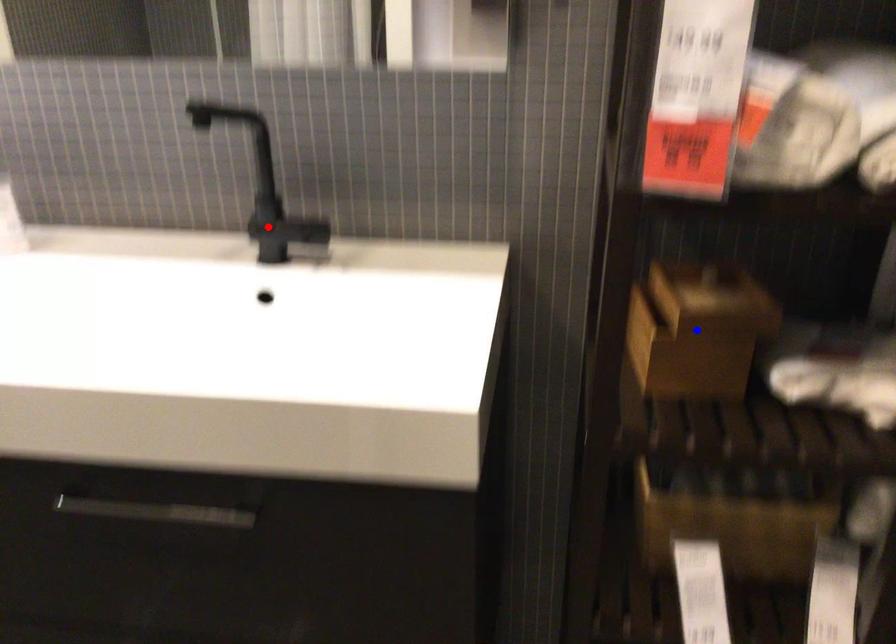
Question: Two points are marked on the image. Which point is closer to the camera?

Choices:
 (A) Blue point is closer.
 (B) Red point is closer.

Answer: (A)